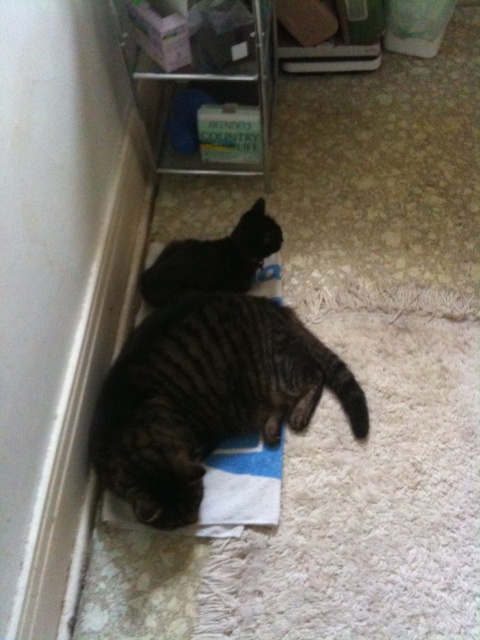
Between point (132, 420) and point (254, 248), which one is positioned behind?

The point (254, 248) is more distant.

Based on the photo, does striped fur cat at lower left lie behind black fur cat at center?

No.

Measure the distance between striped fur cat at lower left and camera.

striped fur cat at lower left is 3.35 feet away from camera.

This screenshot has height=640, width=480. I want to click on striped fur cat at lower left, so tap(207, 396).